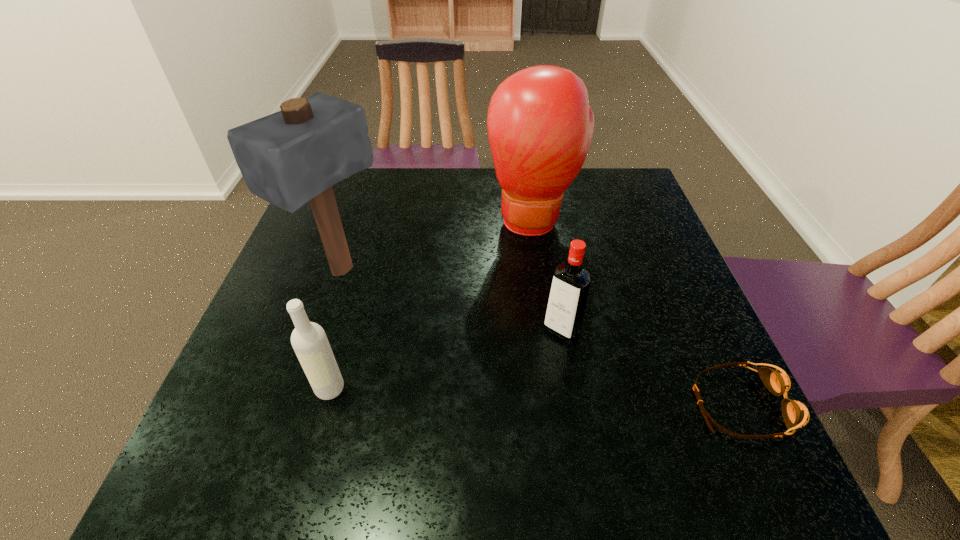
This screenshot has width=960, height=540. I want to click on vacant space on the desktop that is between the nearer vodka and the goggles and is positioned on the striking surface of the mallet, so tap(576, 398).

You are a GUI agent. You are given a task and a screenshot of the screen. Output one action in this format:
    pyautogui.click(x=<x>, y=<y>)
    Task: Click on the free space on the desktop that is between the left vodka and the rightmost object and is positioned on the striking surface of the boxing glove
    
    Given the screenshot: What is the action you would take?
    pyautogui.click(x=532, y=396)

Identify the location of free space on the desktop that is between the nearer vodka and the shortest object and is positioned on the front and back of the farther vodka. (506, 395).